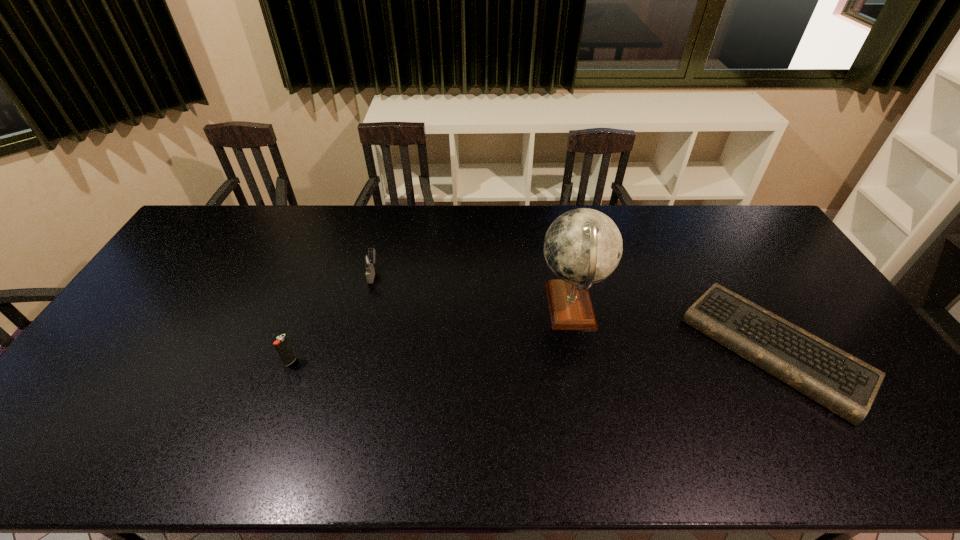
Identify the location of free space between the farther igniter and the globe. (472, 291).

Locate an element on the screen. Image resolution: width=960 pixels, height=540 pixels. vacant space that's between the tallest object and the leftmost object is located at coordinates (431, 335).

This screenshot has width=960, height=540. Identify the location of blank region between the globe and the leftmost object. (431, 335).

I want to click on free spot between the computer keyboard and the tallest object, so click(x=673, y=328).

This screenshot has height=540, width=960. Find the location of `vacant area that lies between the shortest object and the leftmost object`. vacant area that lies between the shortest object and the leftmost object is located at coordinates (533, 355).

At what (x,y) coordinates should I click in order to perform the action: click on vacant space that's between the tallest object and the left igniter. Please return your answer as a coordinate pair (x, y). Looking at the image, I should click on (431, 335).

In order to click on free space between the left igniter and the shortest object in this screenshot , I will do `click(533, 355)`.

Where is `free space between the globe and the leftmost object`? Image resolution: width=960 pixels, height=540 pixels. free space between the globe and the leftmost object is located at coordinates (431, 335).

You are a GUI agent. You are given a task and a screenshot of the screen. Output one action in this format:
    pyautogui.click(x=<x>, y=<y>)
    Task: Click on the vacant area that lies between the globe and the farther igniter
    
    Given the screenshot: What is the action you would take?
    [x=472, y=291]

This screenshot has height=540, width=960. In order to click on the closest object to the right igniter in this screenshot , I will do `click(282, 345)`.